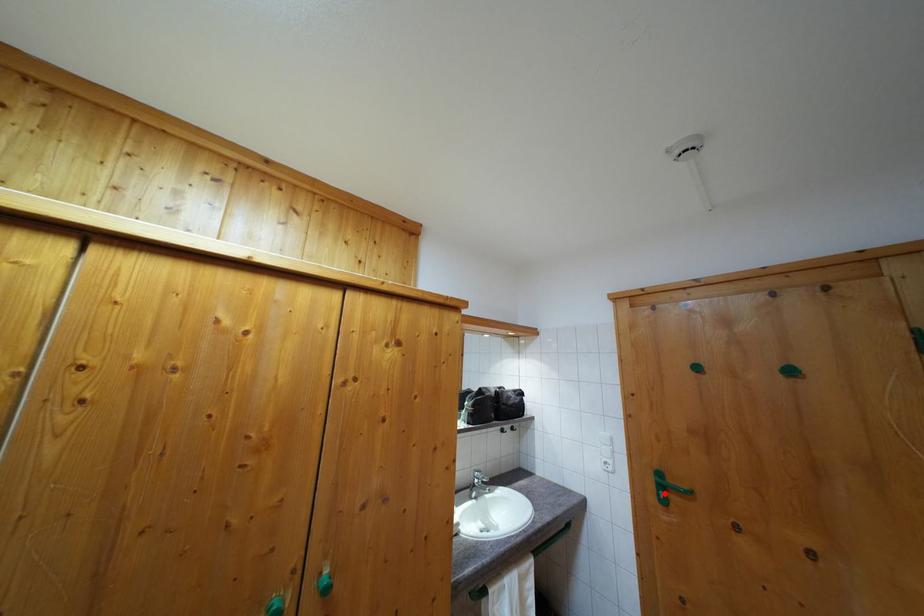
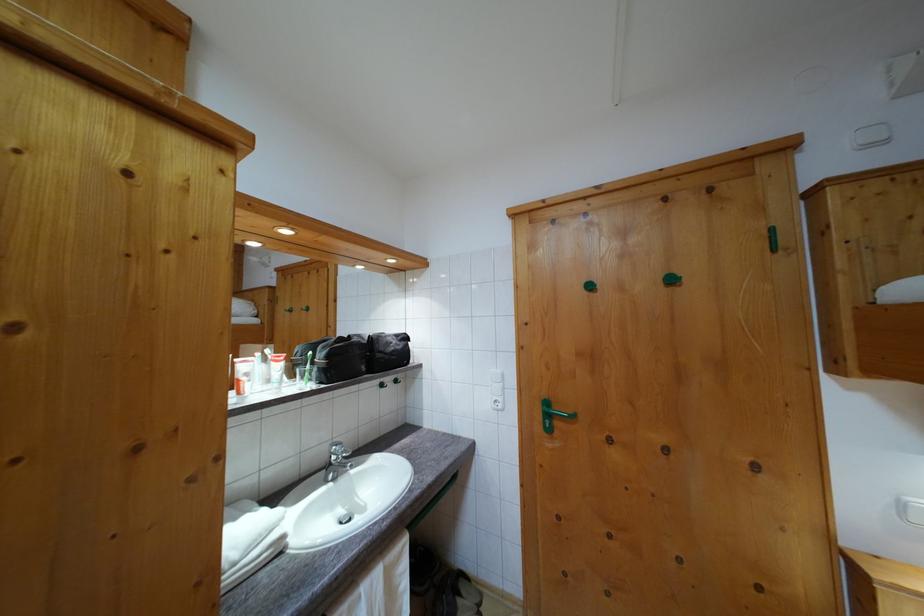
Question: I am providing you with two images of the same scene from different viewpoints. A red point is marked on the first image. Can you still see the location of the red point in image 2?

Choices:
 (A) Yes
 (B) No

Answer: (A)